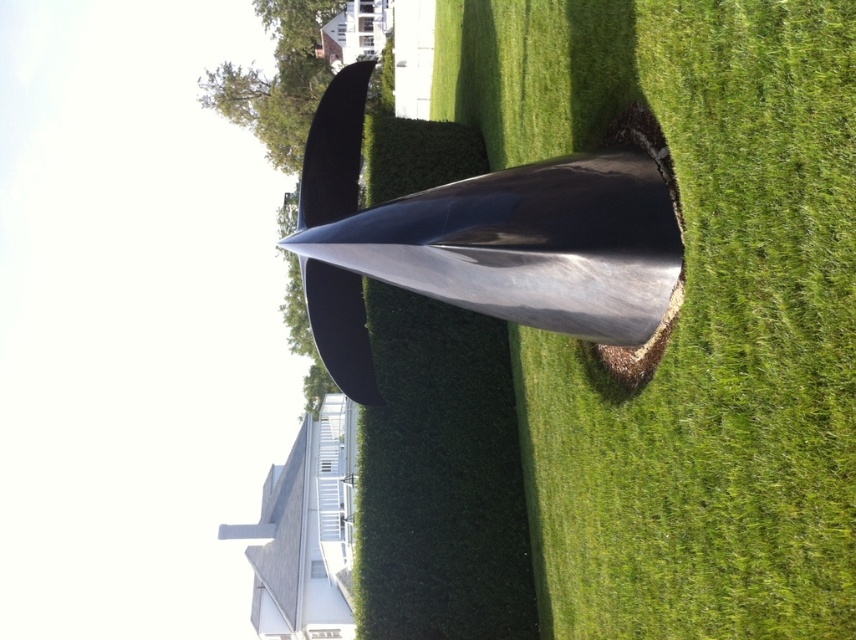
Question: Does green grass at center appear under shiny metallic cone at center?

Choices:
 (A) no
 (B) yes

Answer: (B)

Question: Can you confirm if green grass at center is positioned above shiny metallic cone at center?

Choices:
 (A) no
 (B) yes

Answer: (A)

Question: Among these objects, which one is farthest from the camera?

Choices:
 (A) shiny metallic cone at center
 (B) green grass at center

Answer: (A)

Question: Is green grass at center smaller than shiny metallic cone at center?

Choices:
 (A) no
 (B) yes

Answer: (A)

Question: Which of the following is the farthest from the observer?

Choices:
 (A) shiny metallic cone at center
 (B) green grass at center

Answer: (A)